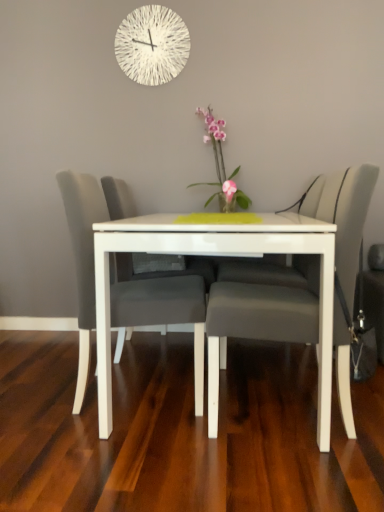
Question: From a real-world perspective, is matte gray chair at center, the first chair viewed from the right, positioned above or below white textured clock at upper center?

Choices:
 (A) above
 (B) below

Answer: (B)

Question: Would you say matte gray chair at center, the first chair viewed from the right, is to the left or to the right of white textured clock at upper center in the picture?

Choices:
 (A) right
 (B) left

Answer: (A)

Question: Estimate the real-world distances between objects in this image. Which object is closer to the white glossy table at center?

Choices:
 (A) matte gray chair at center, positioned as the 2th chair in right-to-left order
 (B) pink glossy vase at center
 (C) white textured clock at upper center
 (D) matte gray chair at center, which ranks as the second chair in left-to-right order

Answer: (D)

Question: Considering the real-world distances, which object is closest to the matte gray chair at center, which ranks as the second chair in left-to-right order?

Choices:
 (A) pink glossy vase at center
 (B) white glossy table at center
 (C) matte gray chair at center, positioned as the 2th chair in right-to-left order
 (D) white textured clock at upper center

Answer: (B)